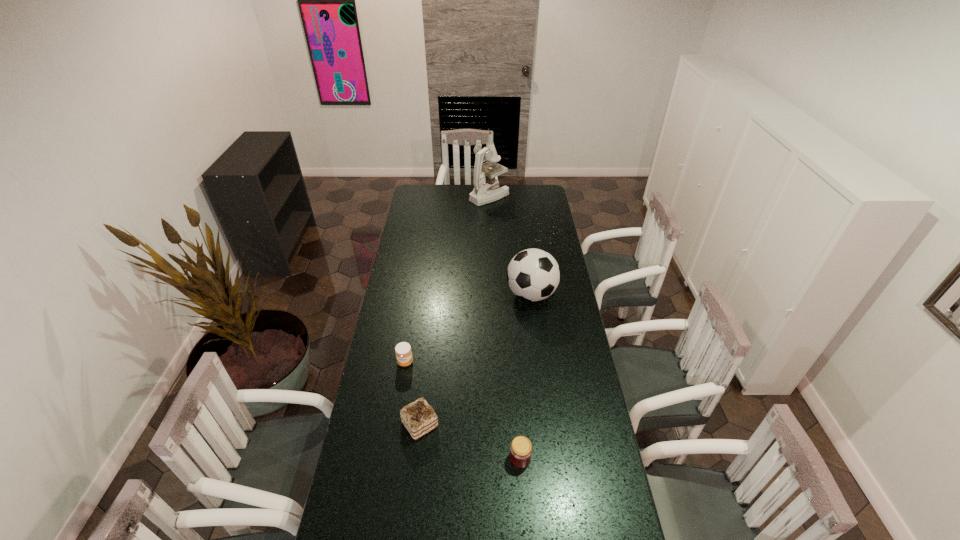
In the image, there is a desktop. Find the location of `vacant space at the right edge`. vacant space at the right edge is located at coordinates (610, 522).

What are the coordinates of `vacant area between the nearest object and the chocolate cake` in the screenshot? It's located at (470, 441).

The width and height of the screenshot is (960, 540). I want to click on unoccupied area between the left jam and the tallest object, so click(447, 279).

Where is `vacant area that lies between the nearer jam and the fourth shortest object`? Image resolution: width=960 pixels, height=540 pixels. vacant area that lies between the nearer jam and the fourth shortest object is located at coordinates (526, 376).

Identify the location of vacant space in between the tallest object and the right jam. (505, 327).

Locate an element on the screen. This screenshot has height=540, width=960. vacant space that is in between the second farthest object and the microscope is located at coordinates (510, 245).

This screenshot has height=540, width=960. In order to click on unoccupied position between the left jam and the chocolate cake in this screenshot , I will do `click(413, 393)`.

Identify the location of the second closest object relative to the third farthest object. (533, 274).

Choose which object is the second nearest neighbor to the third farthest object. Please provide its 2D coordinates. Your answer should be formatted as a tuple, i.e. [(x, y)], where the tuple contains the x and y coordinates of a point satisfying the conditions above.

[(533, 274)]

This screenshot has width=960, height=540. Identify the location of free space that satisfies the following two spatial constraints: 1. on the back side of the right jam; 2. on the right side of the soccer ball. (509, 294).